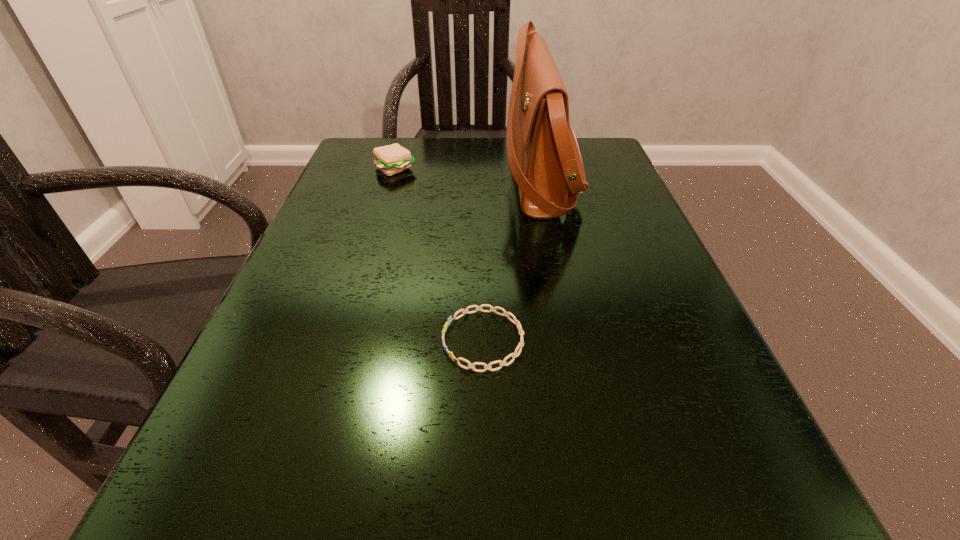
Find the location of a particular element. The height and width of the screenshot is (540, 960). vacant space located on the surface of the shortest object showing star-shaped elements is located at coordinates (295, 340).

Where is `vacant space situated 0.200m on the surface of the shortest object showing star-shaped elements`? vacant space situated 0.200m on the surface of the shortest object showing star-shaped elements is located at coordinates (302, 340).

Where is `satchel present at the far edge`? The image size is (960, 540). satchel present at the far edge is located at coordinates (544, 157).

In order to click on patty situated at the far edge in this screenshot , I will do `click(390, 159)`.

Locate an element on the screen. object located at the left edge is located at coordinates (390, 159).

Locate an element on the screen. The image size is (960, 540). object situated at the right edge is located at coordinates (544, 157).

Find the location of a particular element. The image size is (960, 540). object located at the far left corner is located at coordinates (390, 159).

Find the location of a particular element. The width and height of the screenshot is (960, 540). object situated at the far right corner is located at coordinates (544, 157).

This screenshot has width=960, height=540. I want to click on free space at the far edge, so point(439,153).

Find the location of a particular element. The height and width of the screenshot is (540, 960). vacant space at the left edge of the desktop is located at coordinates (286, 396).